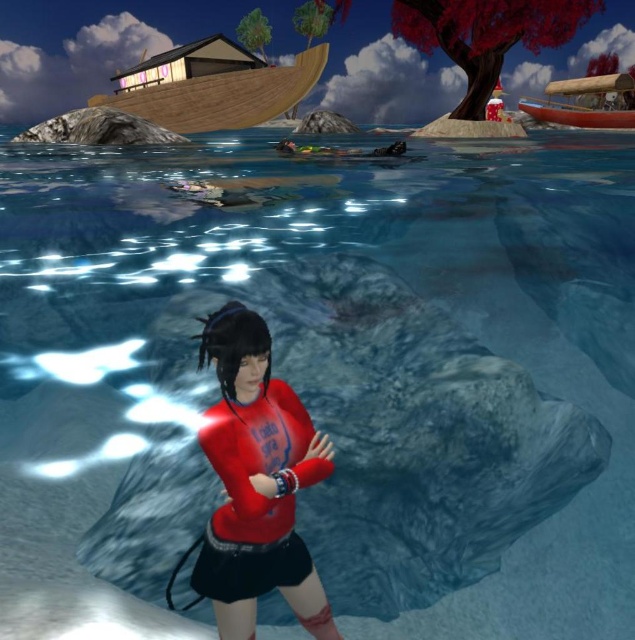
Question: Is shiny red wetsuit at center behind wooden canoe at upper right?

Choices:
 (A) no
 (B) yes

Answer: (A)

Question: Does shiny red wetsuit at center come behind wooden boat at upper left?

Choices:
 (A) yes
 (B) no

Answer: (B)

Question: Which point is closer to the camera?

Choices:
 (A) (211, 56)
 (B) (615, 93)

Answer: (A)

Question: In this image, where is shiny red wetsuit at center located relative to wooden canoe at upper right?

Choices:
 (A) left
 (B) right

Answer: (A)

Question: Which point is closer to the camera taking this photo?

Choices:
 (A) (556, 115)
 (B) (170, 125)
 (C) (215, 588)

Answer: (C)

Question: Which object is the farthest from the wooden boat at upper left?

Choices:
 (A) wooden canoe at upper right
 (B) shiny red wetsuit at center

Answer: (A)